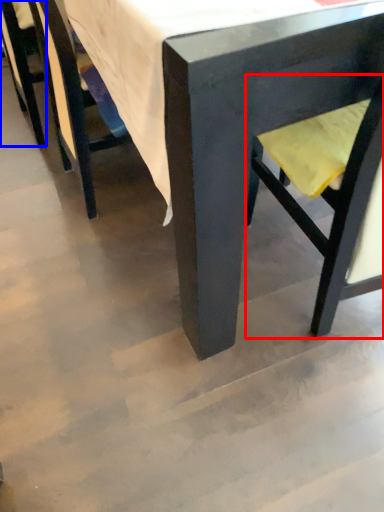
Question: Among these objects, which one is nearest to the camera, swivel chair (highlighted by a red box) or chair (highlighted by a blue box)?

Choices:
 (A) swivel chair
 (B) chair

Answer: (A)